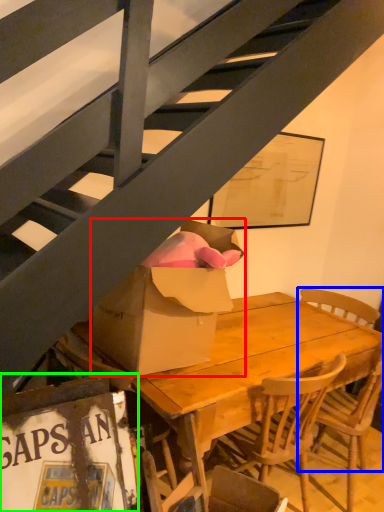
Question: Based on their relative distances, which object is farther from box (highlighted by a red box)? Choose from chair (highlighted by a blue box) and picture frame (highlighted by a green box).

Choices:
 (A) chair
 (B) picture frame

Answer: (A)